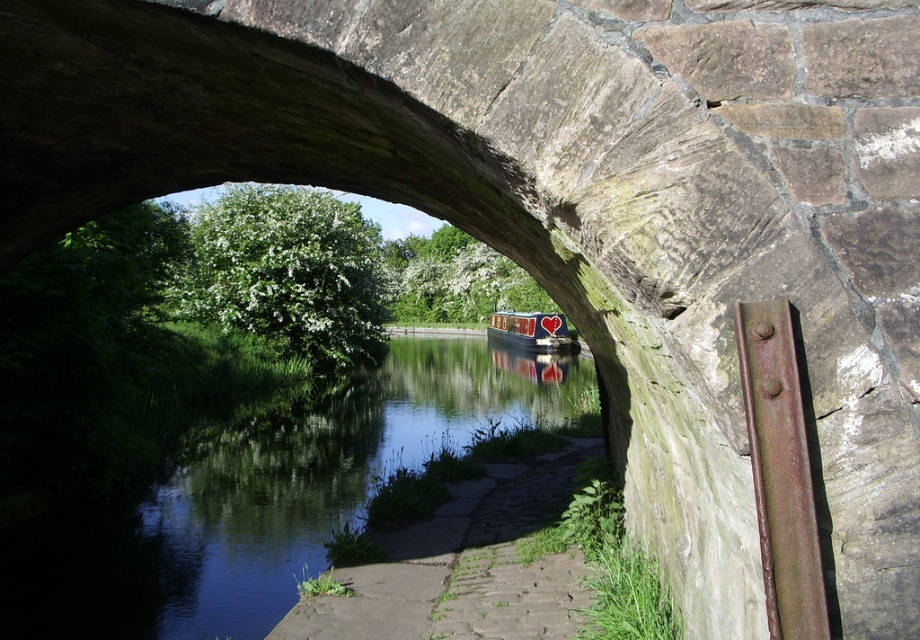
Question: Is green smooth water at center behind matte red canal boat at center?

Choices:
 (A) no
 (B) yes

Answer: (A)

Question: Is green smooth water at center wider than rusty metal rail at right?

Choices:
 (A) yes
 (B) no

Answer: (A)

Question: Which point is farther from the camera taking this photo?

Choices:
 (A) (529, 328)
 (B) (807, 480)
 (C) (553, 401)

Answer: (A)

Question: Estimate the real-world distances between objects in this image. Which object is farther from the green smooth water at center?

Choices:
 (A) matte red canal boat at center
 (B) rusty metal rail at right

Answer: (A)

Question: Does green smooth water at center have a larger size compared to matte red canal boat at center?

Choices:
 (A) yes
 (B) no

Answer: (A)

Question: Based on their relative distances, which object is farther from the matte red canal boat at center?

Choices:
 (A) green smooth water at center
 (B) rusty metal rail at right

Answer: (B)